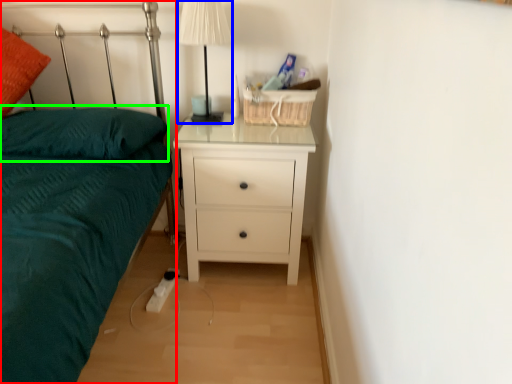
Question: Which is farther away from bed (highlighted by a red box)? table lamp (highlighted by a blue box) or pillow (highlighted by a green box)?

Choices:
 (A) table lamp
 (B) pillow

Answer: (A)